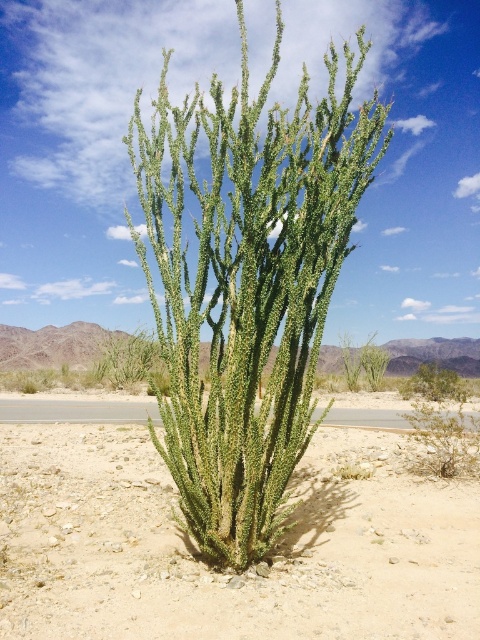
The height and width of the screenshot is (640, 480). What do you see at coordinates (228, 573) in the screenshot?
I see `light brown gravel at center` at bounding box center [228, 573].

Is light brown gravel at center to the right of green spiny cactus at center from the viewer's perspective?

In fact, light brown gravel at center is to the left of green spiny cactus at center.

Looking at this image, who is more forward, (x=300, y=557) or (x=349, y=170)?

Positioned in front is point (x=349, y=170).

Identify the location of light brown gravel at center. (228, 573).